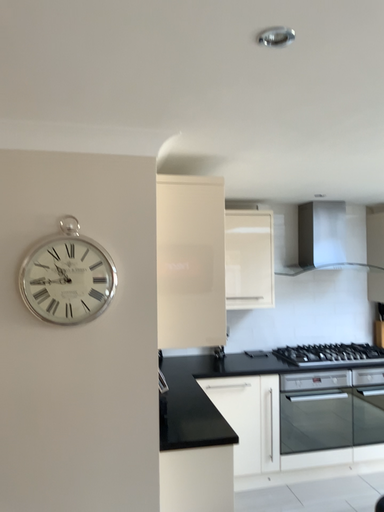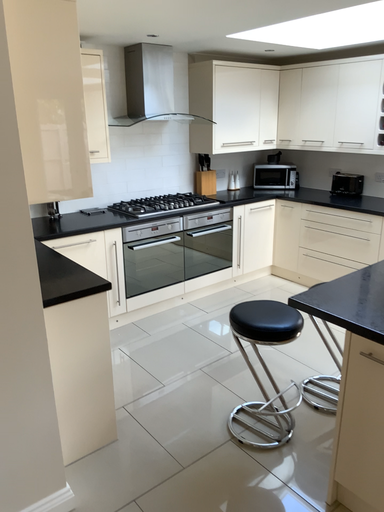
Question: Which way did the camera rotate in the video?

Choices:
 (A) rotated left
 (B) rotated right

Answer: (B)